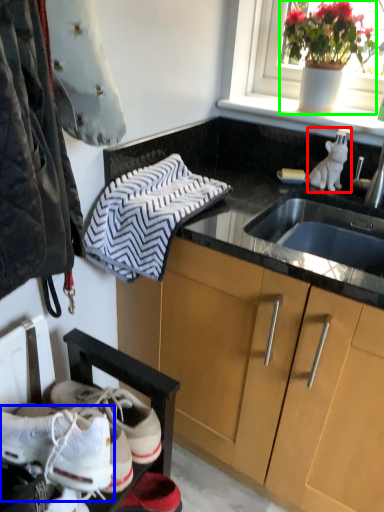
Question: Which object is the farthest from animal (highlighted by a red box)? Choose among these: footwear (highlighted by a blue box) or houseplant (highlighted by a green box).

Choices:
 (A) footwear
 (B) houseplant

Answer: (A)